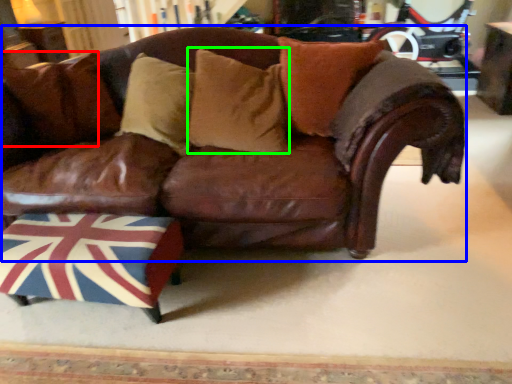
Question: Estimate the real-world distances between objects in this image. Which object is closer to pillow (highlighted by a red box), studio couch (highlighted by a blue box) or pillow (highlighted by a green box)?

Choices:
 (A) studio couch
 (B) pillow

Answer: (A)